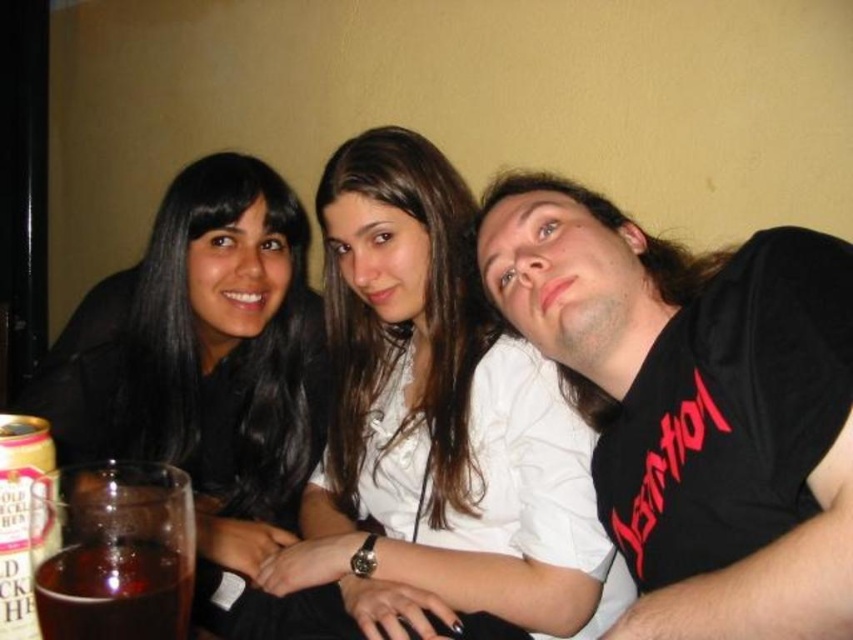
Between smooth white blouse at center and black matte hair at upper left, which one is positioned lower?

Positioned lower is smooth white blouse at center.

Who is more distant from viewer, (572, 426) or (244, 275)?

Positioned behind is point (244, 275).

Does point (572, 492) come closer to viewer compared to point (288, 284)?

Yes, point (572, 492) is closer to viewer.

The width and height of the screenshot is (853, 640). In order to click on smooth white blouse at center in this screenshot , I will do `click(438, 424)`.

Does black matte t-shirt at upper right have a lesser height compared to black matte hair at upper left?

Correct, black matte t-shirt at upper right is not as tall as black matte hair at upper left.

Is point (718, 596) positioned before point (260, 417)?

Yes, it is in front of point (260, 417).

You are a GUI agent. You are given a task and a screenshot of the screen. Output one action in this format:
    pyautogui.click(x=<x>, y=<y>)
    Task: Click on the black matte t-shirt at upper right
    The image size is (853, 640).
    Given the screenshot: What is the action you would take?
    (x=695, y=404)

Which is more to the right, smooth white blouse at center or translucent glass at lower left?

smooth white blouse at center is more to the right.

Does smooth white blouse at center have a greater height compared to translucent glass at lower left?

Yes, smooth white blouse at center is taller than translucent glass at lower left.

Is point (311, 552) positioned after point (164, 611)?

That is True.

The image size is (853, 640). I want to click on smooth white blouse at center, so click(438, 424).